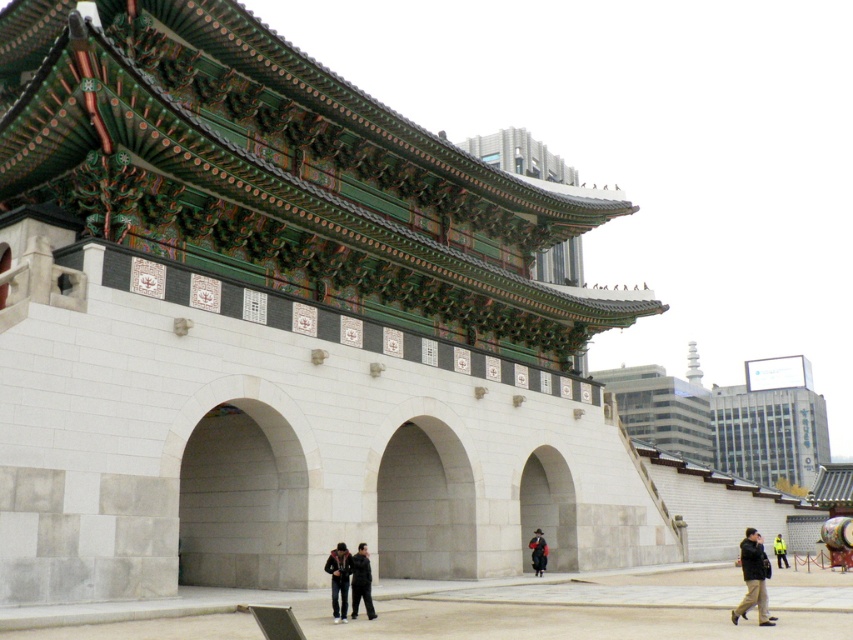
Question: Estimate the real-world distances between objects in this image. Which object is closer to the dark blue jacket at center?

Choices:
 (A) dark gray jacket at lower right
 (B) yellow reflective jacket at center

Answer: (A)

Question: Can you confirm if black leather jacket at center is thinner than yellow reflective jacket at center?

Choices:
 (A) yes
 (B) no

Answer: (A)

Question: Which object appears closest to the camera in this image?

Choices:
 (A) yellow reflective jacket at center
 (B) dark gray jacket at lower right
 (C) black leather jacket at center

Answer: (B)

Question: Is dark gray jacket at lower right bigger than black leather jacket at center?

Choices:
 (A) no
 (B) yes

Answer: (B)

Question: Is dark gray jacket at lower right below dark gray jacket at center?

Choices:
 (A) no
 (B) yes

Answer: (B)

Question: Which object is the farthest from the dark blue jacket at center?

Choices:
 (A) black leather jacket at center
 (B) dark gray jacket at center
 (C) yellow reflective jacket at center
 (D) dark gray jacket at lower right

Answer: (C)